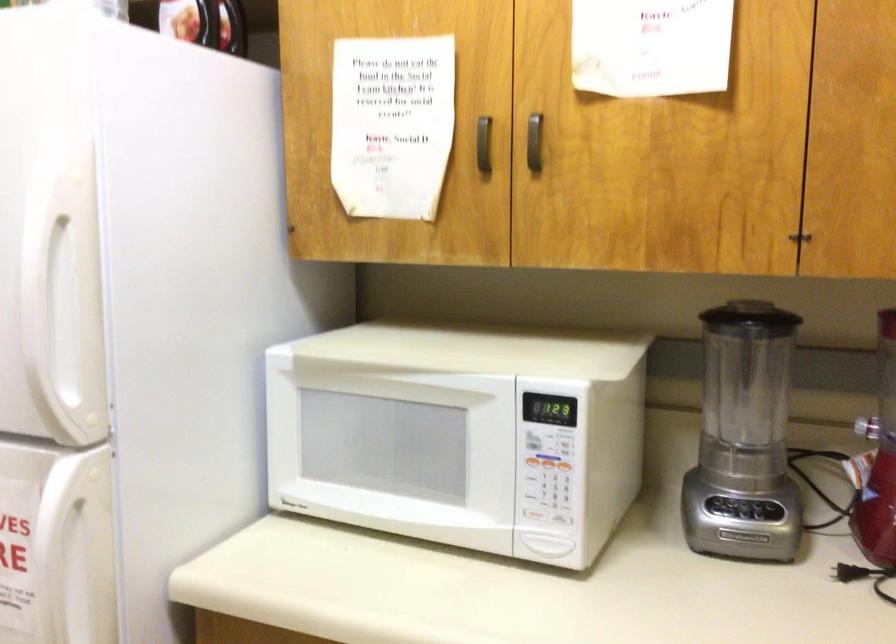
The width and height of the screenshot is (896, 644). What do you see at coordinates (746, 371) in the screenshot? I see `a blender jar` at bounding box center [746, 371].